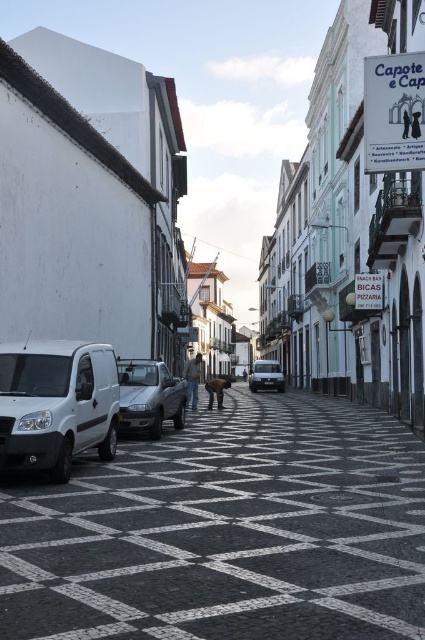
You are a delivery driver with a 7.5 feet wide truck. You see the white glossy van at left and the silver metallic car at center parked on the street. Can your truck fit between them?

The white glossy van at left and the silver metallic car at center are 8.26 feet apart. Since your truck is 7.5 feet wide, it can fit between them as the space is wider than the truck.